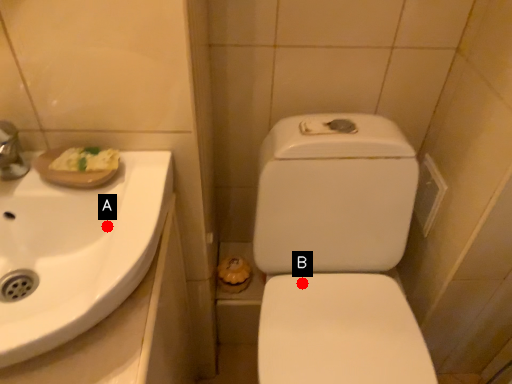
Question: Two points are circled on the image, labeled by A and B beside each circle. Which point is closer to the camera?

Choices:
 (A) A is closer
 (B) B is closer

Answer: (A)